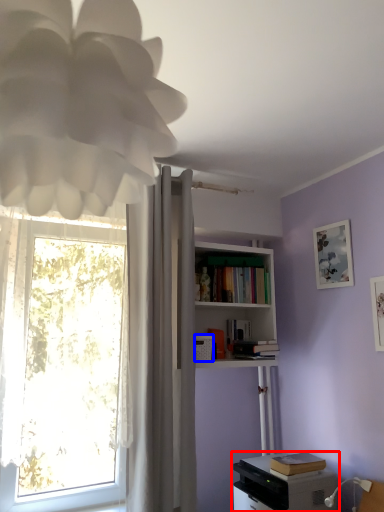
Question: Which of the following is the closest to the observer, printer (highlighted by a red box) or appliance (highlighted by a blue box)?

Choices:
 (A) printer
 (B) appliance

Answer: (A)